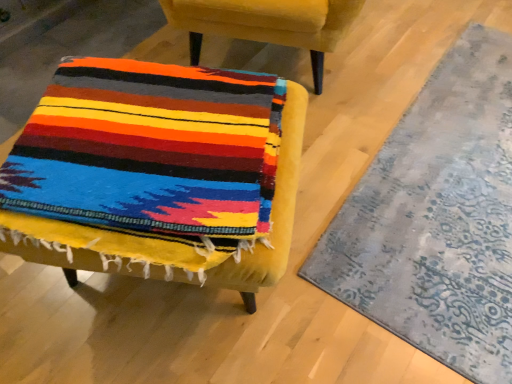
Question: Considering the relative sizes of velvet yellow chair at lower left, the 2th chair in the bottom-to-top sequence, and textured gray rug at lower right in the image provided, is velvet yellow chair at lower left, the 2th chair in the bottom-to-top sequence, shorter than textured gray rug at lower right?

Choices:
 (A) no
 (B) yes

Answer: (A)

Question: Is velvet yellow chair at lower left, which is the first chair in top-to-bottom order, turned away from textured gray rug at lower right?

Choices:
 (A) yes
 (B) no

Answer: (B)

Question: Is velvet yellow chair at lower left, the 2th chair in the bottom-to-top sequence, directly adjacent to textured gray rug at lower right?

Choices:
 (A) no
 (B) yes

Answer: (A)

Question: Does velvet yellow chair at lower left, the 2th chair in the bottom-to-top sequence, lie behind textured gray rug at lower right?

Choices:
 (A) no
 (B) yes

Answer: (B)

Question: Can you confirm if velvet yellow chair at lower left, which is the first chair in top-to-bottom order, is taller than textured gray rug at lower right?

Choices:
 (A) yes
 (B) no

Answer: (A)

Question: From a real-world perspective, is velvet yellow chair at center, arranged as the second chair when viewed from the top, positioned above or below velvet yellow chair at lower left, the 2th chair in the bottom-to-top sequence?

Choices:
 (A) below
 (B) above

Answer: (A)

Question: Would you say velvet yellow chair at center, arranged as the second chair when viewed from the top, is inside or outside velvet yellow chair at lower left, which is the first chair in top-to-bottom order?

Choices:
 (A) inside
 (B) outside

Answer: (B)

Question: Is point coord(162,241) positioned closer to the camera than point coord(345,3)?

Choices:
 (A) closer
 (B) farther

Answer: (A)

Question: From their relative heights in the image, would you say velvet yellow chair at center, arranged as the second chair when viewed from the top, is taller or shorter than velvet yellow chair at lower left, the 2th chair in the bottom-to-top sequence?

Choices:
 (A) tall
 (B) short

Answer: (B)

Question: Does point (214, 218) appear closer or farther from the camera than point (501, 243)?

Choices:
 (A) closer
 (B) farther

Answer: (A)

Question: In the image, is velvet yellow chair at center, arranged as the second chair when viewed from the top, positioned in front of or behind textured gray rug at lower right?

Choices:
 (A) behind
 (B) front

Answer: (B)

Question: From a real-world perspective, is velvet yellow chair at center, marked as the 1th chair in a bottom-to-top arrangement, physically located above or below textured gray rug at lower right?

Choices:
 (A) above
 (B) below

Answer: (A)

Question: In terms of width, does velvet yellow chair at center, marked as the 1th chair in a bottom-to-top arrangement, look wider or thinner when compared to textured gray rug at lower right?

Choices:
 (A) wide
 (B) thin

Answer: (A)

Question: In terms of height, does velvet yellow chair at lower left, which is the first chair in top-to-bottom order, look taller or shorter compared to velvet yellow chair at center, marked as the 1th chair in a bottom-to-top arrangement?

Choices:
 (A) tall
 (B) short

Answer: (A)

Question: From the image's perspective, is velvet yellow chair at lower left, the 2th chair in the bottom-to-top sequence, above or below velvet yellow chair at center, arranged as the second chair when viewed from the top?

Choices:
 (A) below
 (B) above

Answer: (B)